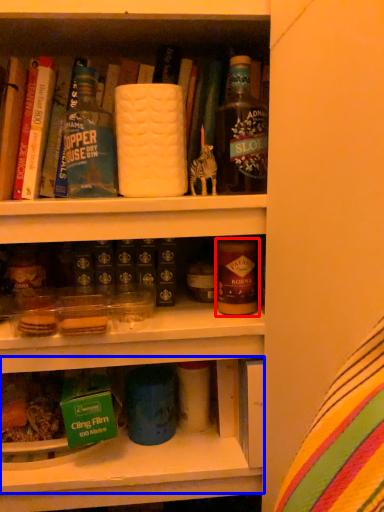
Question: Which point is closer to the camera, beverage (highlighted by a red box) or shelf (highlighted by a blue box)?

Choices:
 (A) beverage
 (B) shelf

Answer: (B)